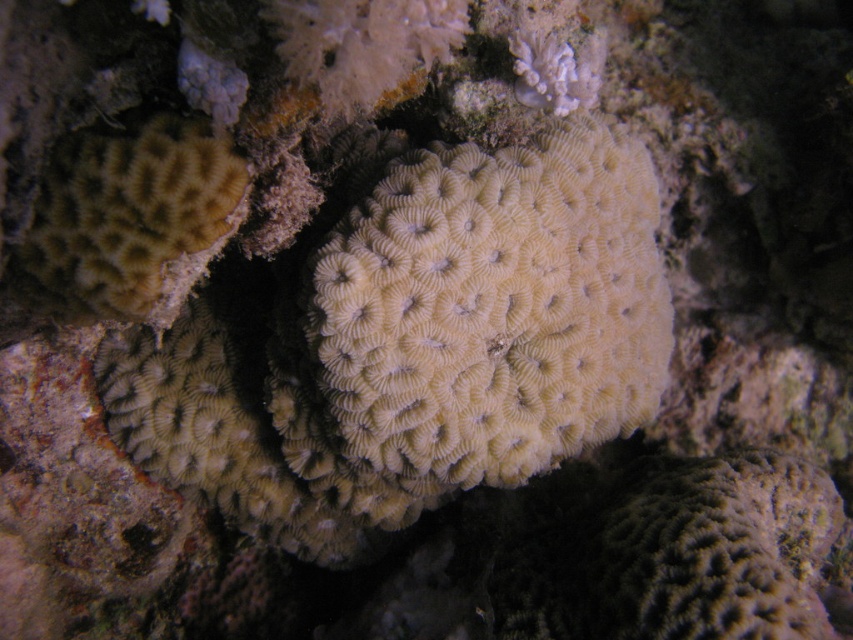
You are a marine biologist examining a coral reef. You notice the white matte coral at center and the light brown textured coral at left. Which coral would you need to move closer to your underwater camera to get a detailed shot of its surface texture?

The light brown textured coral at left requires moving closer because it is smaller in size than the white matte coral at center, making its surface details harder to capture from a distance.

You are a marine biologist diving in the coral reef and need to collect a sample from the white matte coral at center. Your sampling tool has a maximum reach of 1 meter. Can you safely collect the sample without moving closer?

The white matte coral at center is 98.70 centimeters away from the viewer, which is within the 1 meter reach of the sampling tool. Therefore, you can safely collect the sample without moving closer.

You are a marine biologist examining the coral reef. You need to determine the spatial relationship between the white matte coral at center and the light brown textured coral at left. Which coral has a greater width?

The white matte coral at center might be wider than light brown textured coral at left.